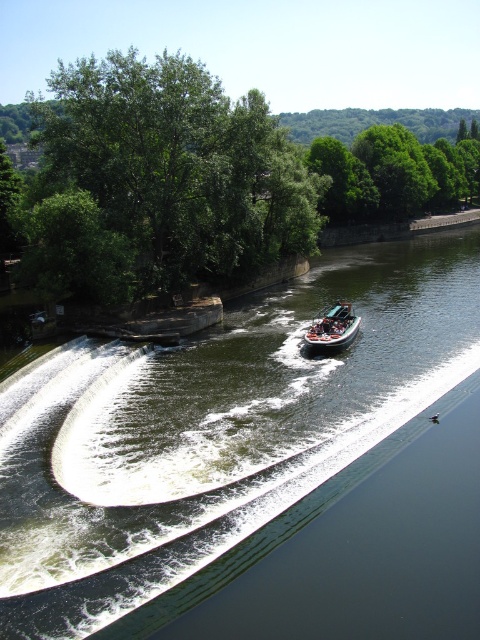
Is point (244, 365) positioned in front of point (262, 147)?

That is True.

Measure the distance between green smooth water at center and green leafy tree at upper left.

A distance of 44.04 meters exists between green smooth water at center and green leafy tree at upper left.

Is point (453, 253) less distant than point (471, 189)?

That is True.

Identify the location of green smooth water at center. The width and height of the screenshot is (480, 640). (214, 429).

Can you confirm if green leafy tree at upper left is smaller than green leafy trees at upper center?

Incorrect, green leafy tree at upper left is not smaller in size than green leafy trees at upper center.

I want to click on green leafy tree at upper left, so click(202, 179).

Does green smooth water at center have a lesser height compared to orange fiberglass speedboat at center?

Incorrect, green smooth water at center's height does not fall short of orange fiberglass speedboat at center's.

Does green smooth water at center appear under orange fiberglass speedboat at center?

Indeed, green smooth water at center is positioned under orange fiberglass speedboat at center.

The width and height of the screenshot is (480, 640). What do you see at coordinates (214, 429) in the screenshot?
I see `green smooth water at center` at bounding box center [214, 429].

Where is `green smooth water at center`? The image size is (480, 640). green smooth water at center is located at coordinates (214, 429).